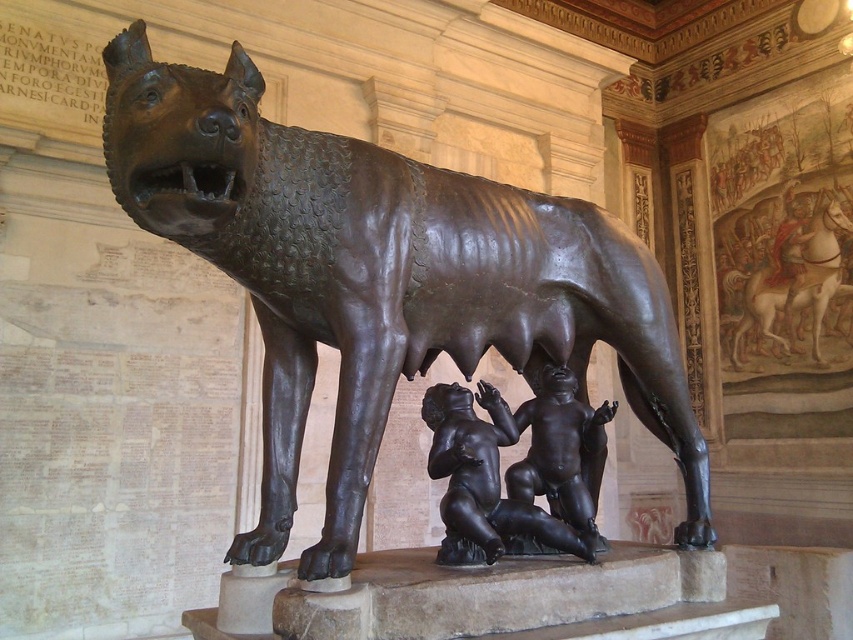
You are an art conservator assessing the placement of the polished bronze twin figures at center and the bronze horse at upper right. Which object is taller?

The bronze horse at upper right is taller than the polished bronze twin figures at center.

You are an art conservator assessing the space requirements for transporting the bronze textured wolf at center and the bronze horse at upper right. Given that the transport crate must accommodate the larger of the two, which object should you prioritize fitting the crate to?

The bronze textured wolf at center should be prioritized as its width is larger than the bronze horse at upper right, so the crate must be sized to accommodate it.